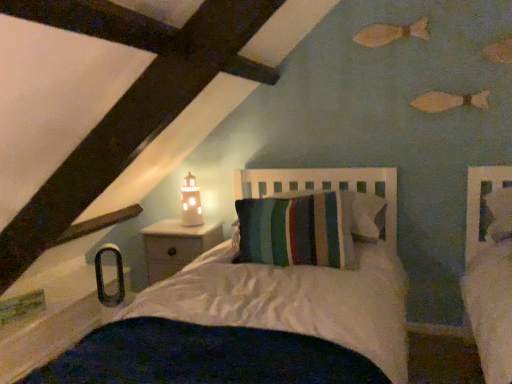
Question: Is matte white lighthouse at upper center not close to striped fabric pillow at center?

Choices:
 (A) no
 (B) yes

Answer: (A)

Question: Is matte white lighthouse at upper center facing away from striped fabric pillow at center?

Choices:
 (A) yes
 (B) no

Answer: (B)

Question: Can you confirm if matte white lighthouse at upper center is smaller than striped fabric pillow at center?

Choices:
 (A) yes
 (B) no

Answer: (A)

Question: Can you confirm if matte white lighthouse at upper center is taller than striped fabric pillow at center?

Choices:
 (A) yes
 (B) no

Answer: (A)

Question: Does matte white lighthouse at upper center have a larger size compared to striped fabric pillow at center?

Choices:
 (A) yes
 (B) no

Answer: (B)

Question: Would you say white wood nightstand at lower left is to the left or to the right of matte white lighthouse at upper center in the picture?

Choices:
 (A) right
 (B) left

Answer: (B)

Question: From the image's perspective, relative to matte white lighthouse at upper center, is white wood nightstand at lower left above or below?

Choices:
 (A) above
 (B) below

Answer: (B)

Question: From their relative heights in the image, would you say white wood nightstand at lower left is taller or shorter than matte white lighthouse at upper center?

Choices:
 (A) tall
 (B) short

Answer: (A)

Question: Does point (185, 253) appear closer or farther from the camera than point (194, 218)?

Choices:
 (A) closer
 (B) farther

Answer: (A)

Question: Is matte white lighthouse at upper center spatially inside striped fabric pillow at center, or outside of it?

Choices:
 (A) outside
 (B) inside

Answer: (A)

Question: Looking at the image, does matte white lighthouse at upper center seem bigger or smaller compared to striped fabric pillow at center?

Choices:
 (A) big
 (B) small

Answer: (B)

Question: From the image's perspective, is matte white lighthouse at upper center positioned above or below striped fabric pillow at center?

Choices:
 (A) below
 (B) above

Answer: (B)

Question: In terms of height, does matte white lighthouse at upper center look taller or shorter compared to striped fabric pillow at center?

Choices:
 (A) short
 (B) tall

Answer: (B)

Question: Looking at their shapes, would you say striped fabric pillow at center is wider or thinner than matte white lighthouse at upper center?

Choices:
 (A) thin
 (B) wide

Answer: (B)

Question: Is striped fabric pillow at center situated inside matte white lighthouse at upper center or outside?

Choices:
 (A) outside
 (B) inside

Answer: (A)